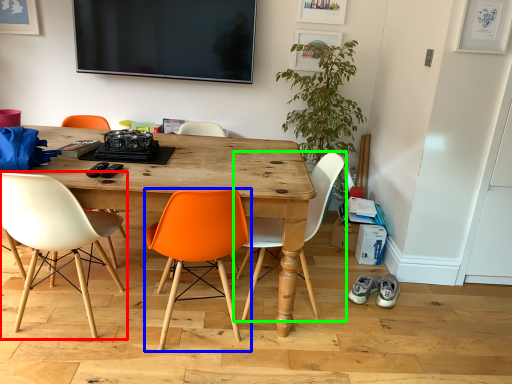
Question: Which object is the closest to the chair (highlighted by a red box)? Choose among these: chair (highlighted by a blue box) or chair (highlighted by a green box).

Choices:
 (A) chair
 (B) chair

Answer: (A)